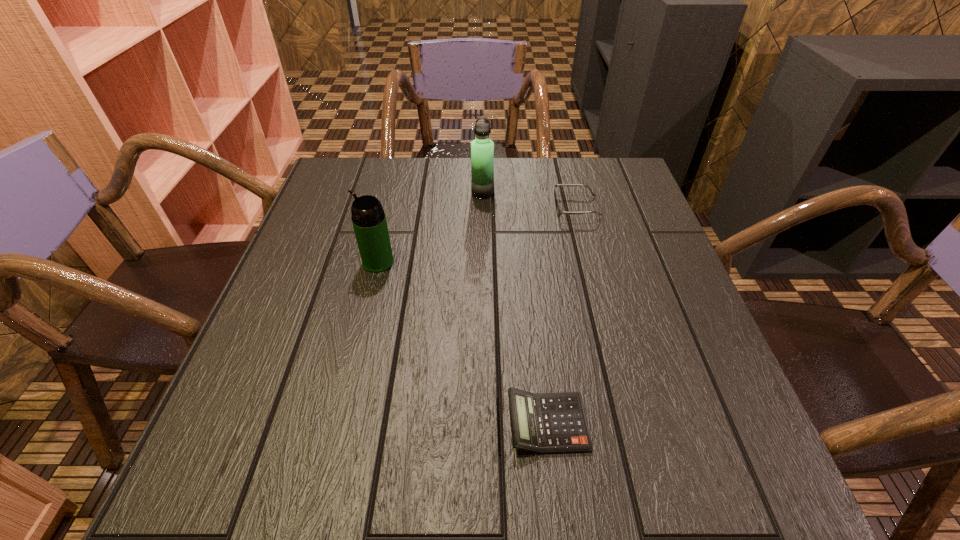
Locate an element on the screen. Image resolution: width=960 pixels, height=540 pixels. free space located 0.130m from the spout of the leftmost object is located at coordinates (305, 262).

Where is `free spot located 0.230m on the front-facing side of the sunglasses`? The image size is (960, 540). free spot located 0.230m on the front-facing side of the sunglasses is located at coordinates (467, 207).

Locate an element on the screen. This screenshot has height=540, width=960. vacant space located 0.260m on the front-facing side of the sunglasses is located at coordinates (455, 207).

Find the location of a particular element. The width and height of the screenshot is (960, 540). vacant area situated on the front-facing side of the sunglasses is located at coordinates (524, 207).

Identify the location of free location located 0.110m on the left of the second object from right to left. This screenshot has height=540, width=960. (442, 423).

Find the location of `thermos bottle located in the far edge section of the desktop`. thermos bottle located in the far edge section of the desktop is located at coordinates (482, 148).

The image size is (960, 540). Find the location of `sunglasses that is at the far edge`. sunglasses that is at the far edge is located at coordinates (559, 211).

You are a GUI agent. You are given a task and a screenshot of the screen. Output one action in this format:
    pyautogui.click(x=<x>, y=<y>)
    Task: Click on the object that is positioned at the near edge
    The width and height of the screenshot is (960, 540).
    Given the screenshot: What is the action you would take?
    pyautogui.click(x=545, y=423)

You are a GUI agent. You are given a task and a screenshot of the screen. Output one action in this format:
    pyautogui.click(x=<x>, y=<y>)
    Task: Click on the object situated at the right edge
    This screenshot has width=960, height=540.
    Given the screenshot: What is the action you would take?
    pyautogui.click(x=559, y=211)

You are a GUI agent. You are given a task and a screenshot of the screen. Output one action in this format:
    pyautogui.click(x=<x>, y=<y>)
    Task: Click on the object that is at the far right corner
    
    Given the screenshot: What is the action you would take?
    pyautogui.click(x=559, y=211)